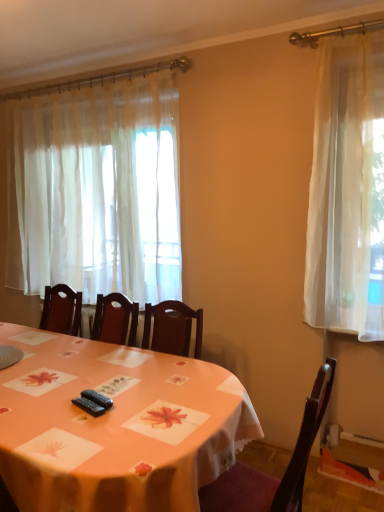
Question: Is sheer white curtain at left positioned with its back to wooden chair at center?

Choices:
 (A) yes
 (B) no

Answer: (B)

Question: Is sheer white curtain at left to the right of wooden chair at center from the viewer's perspective?

Choices:
 (A) no
 (B) yes

Answer: (A)

Question: From the image's perspective, is sheer white curtain at left on wooden chair at center?

Choices:
 (A) yes
 (B) no

Answer: (A)

Question: Is sheer white curtain at left next to wooden chair at center and touching it?

Choices:
 (A) no
 (B) yes

Answer: (A)

Question: Considering the relative positions of sheer white curtain at left and wooden chair at center in the image provided, is sheer white curtain at left in front of wooden chair at center?

Choices:
 (A) no
 (B) yes

Answer: (A)

Question: Is wooden chair at center bigger or smaller than orange fabric table at center?

Choices:
 (A) big
 (B) small

Answer: (B)

Question: Considering the relative positions of wooden chair at center and orange fabric table at center in the image provided, is wooden chair at center to the left or to the right of orange fabric table at center?

Choices:
 (A) right
 (B) left

Answer: (A)

Question: Is point (218, 498) closer or farther from the camera than point (41, 496)?

Choices:
 (A) farther
 (B) closer

Answer: (A)

Question: Relative to orange fabric table at center, is wooden chair at center in front or behind?

Choices:
 (A) front
 (B) behind

Answer: (B)

Question: In the image, is orange fabric table at center positioned in front of or behind sheer white curtain at left?

Choices:
 (A) behind
 (B) front

Answer: (B)

Question: From the image's perspective, relative to sheer white curtain at left, is orange fabric table at center above or below?

Choices:
 (A) above
 (B) below

Answer: (B)

Question: Does point (1, 375) appear closer or farther from the camera than point (92, 253)?

Choices:
 (A) closer
 (B) farther

Answer: (A)

Question: Which is correct: orange fabric table at center is inside sheer white curtain at left, or outside of it?

Choices:
 (A) outside
 (B) inside

Answer: (A)

Question: Considering the positions of sheer white curtain at left and wooden chair at center in the image, is sheer white curtain at left taller or shorter than wooden chair at center?

Choices:
 (A) tall
 (B) short

Answer: (A)

Question: Is sheer white curtain at left wider or thinner than wooden chair at center?

Choices:
 (A) wide
 (B) thin

Answer: (B)